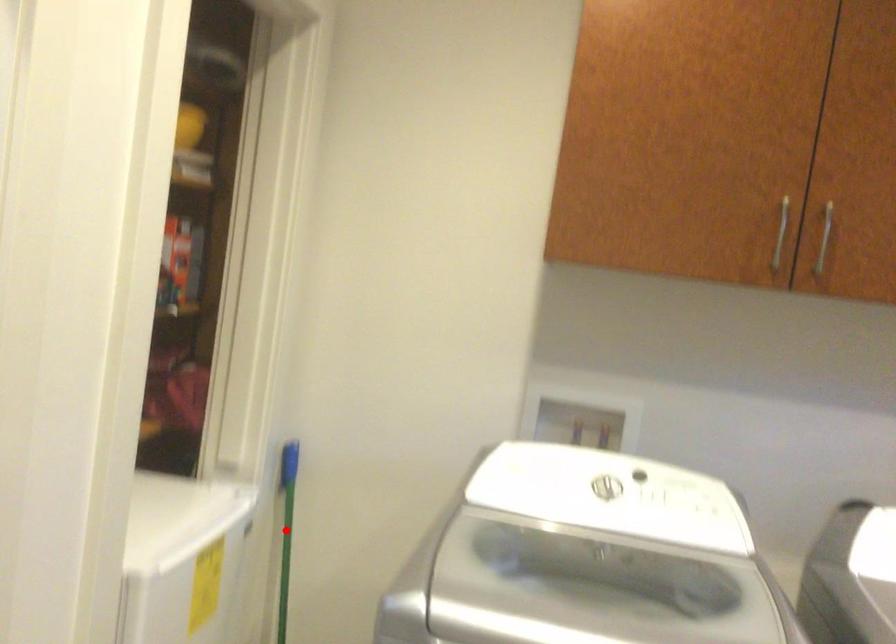
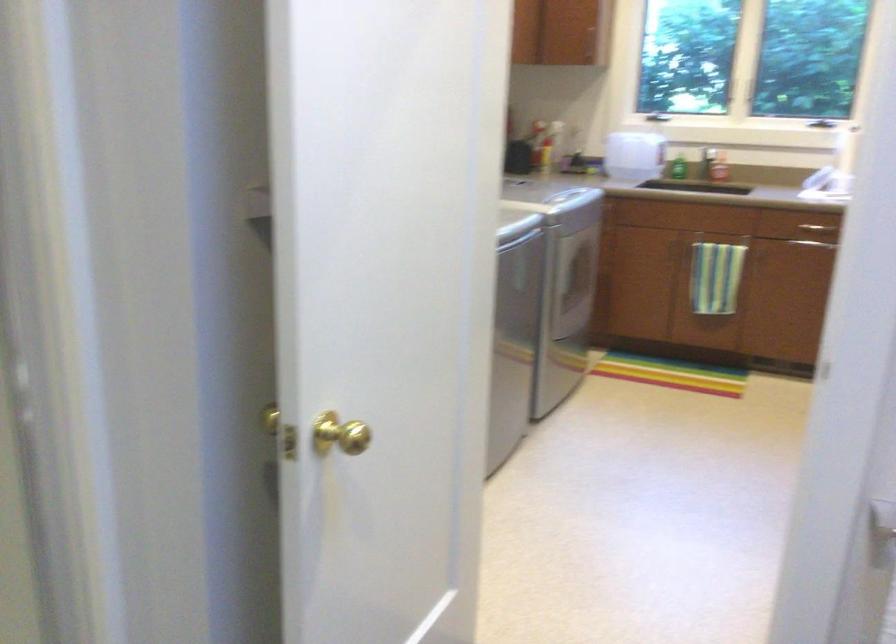
Question: I am providing you with two images of the same scene from different viewpoints. A red point is marked on the first image. At the location where the point appears in image 1, is it still visible in image 2?

Choices:
 (A) Yes
 (B) No

Answer: (B)